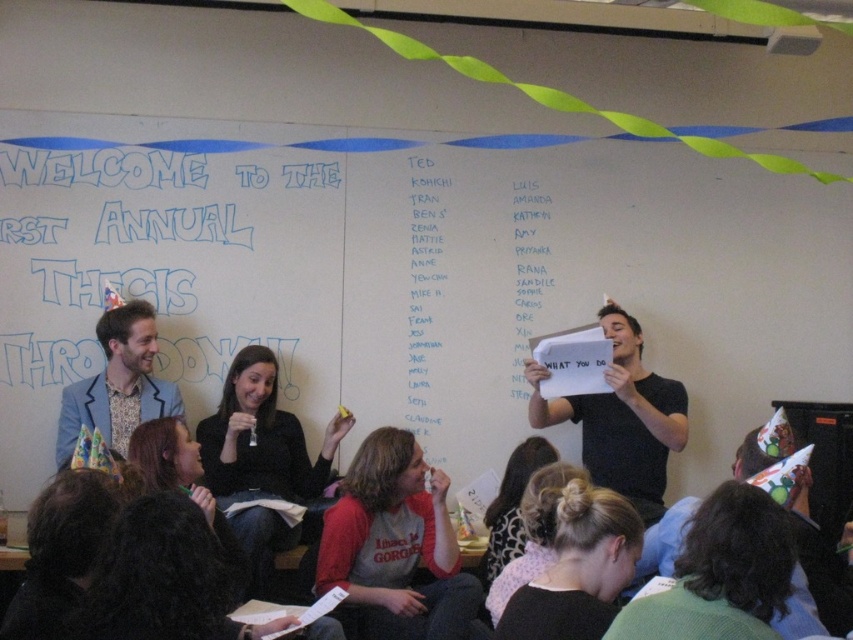
Does whiteboard at upper center have a greater width compared to black matte paper at center?

Correct, the width of whiteboard at upper center exceeds that of black matte paper at center.

Between point (114, 269) and point (648, 515), which one is positioned in front?

Point (648, 515) is in front.

Where is `whiteboard at upper center`? The width and height of the screenshot is (853, 640). whiteboard at upper center is located at coordinates (405, 273).

Does black matte paper at center have a greater height compared to patterned fabric shirt at left?

Yes, black matte paper at center is taller than patterned fabric shirt at left.

In the scene shown: Is black matte paper at center wider than patterned fabric shirt at left?

Yes, black matte paper at center is wider than patterned fabric shirt at left.

Does point (640, 406) come in front of point (143, 321)?

Yes.

The image size is (853, 640). I want to click on black matte paper at center, so click(x=621, y=419).

Is the position of whiteboard at upper center more distant than that of white paper list at center?

No, whiteboard at upper center is in front of white paper list at center.

Locate an element on the screen. The width and height of the screenshot is (853, 640). whiteboard at upper center is located at coordinates (405, 273).

Locate an element on the screen. Image resolution: width=853 pixels, height=640 pixels. whiteboard at upper center is located at coordinates (405, 273).